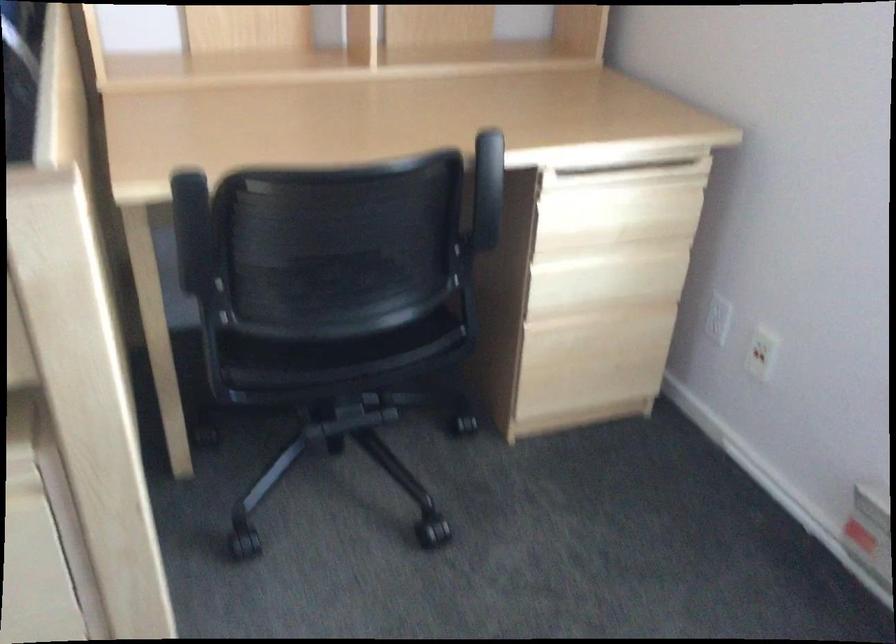
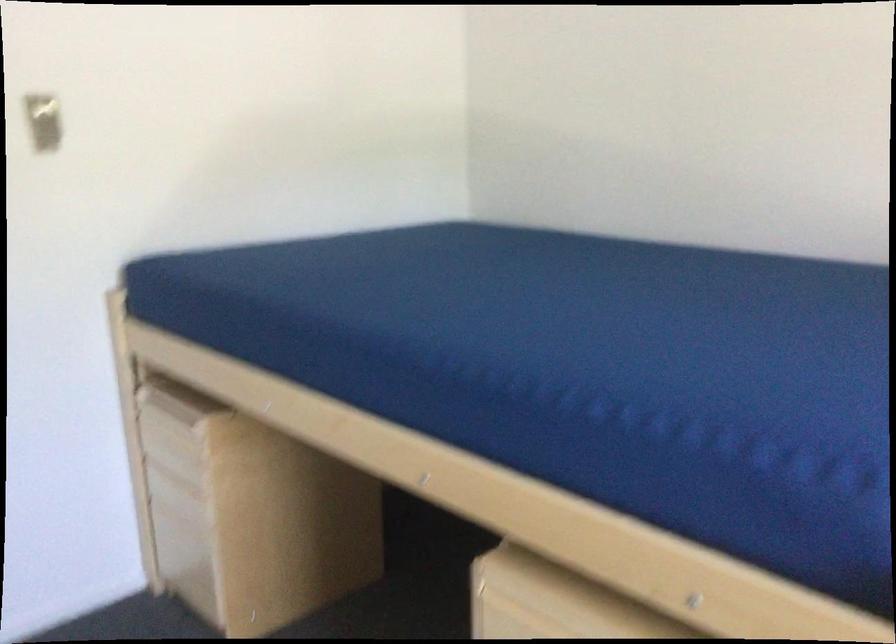
Question: The camera is either moving clockwise (left) or counter-clockwise (right) around the object. The first image is from the beginning of the video and the second image is from the end. Is the camera moving left or right when shooting the video?

Choices:
 (A) Left
 (B) Right

Answer: (B)